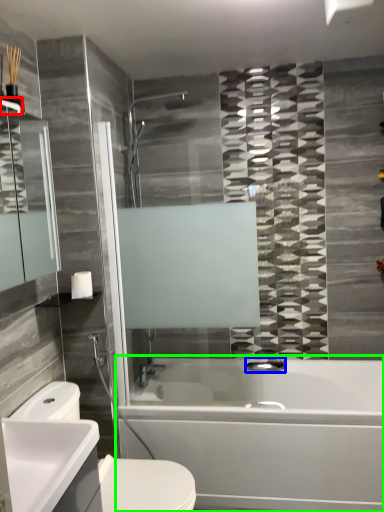
Question: Considering the real-world distances, which object is closest to towel bar (highlighted by a red box)? plumbing fixture (highlighted by a blue box) or bathtub (highlighted by a green box).

Choices:
 (A) plumbing fixture
 (B) bathtub

Answer: (B)